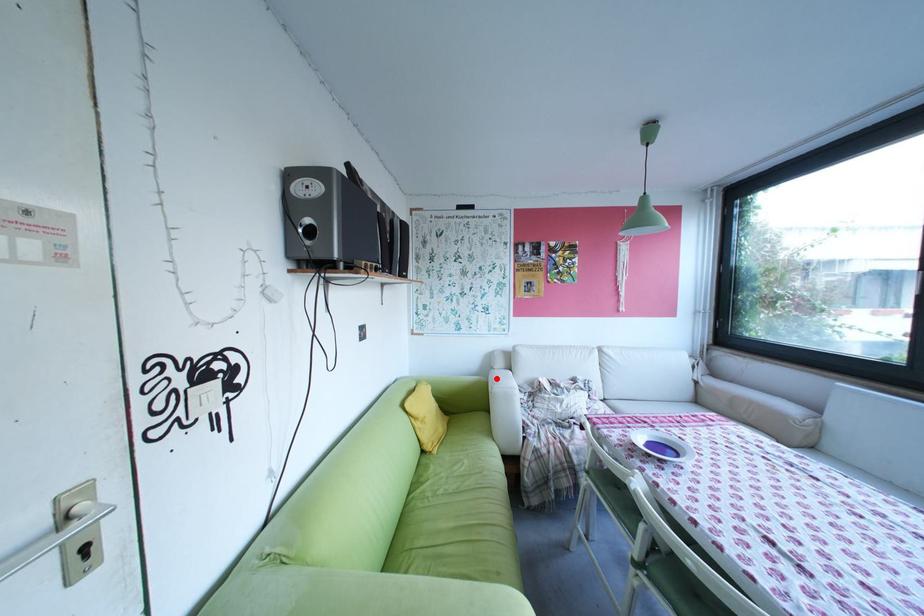
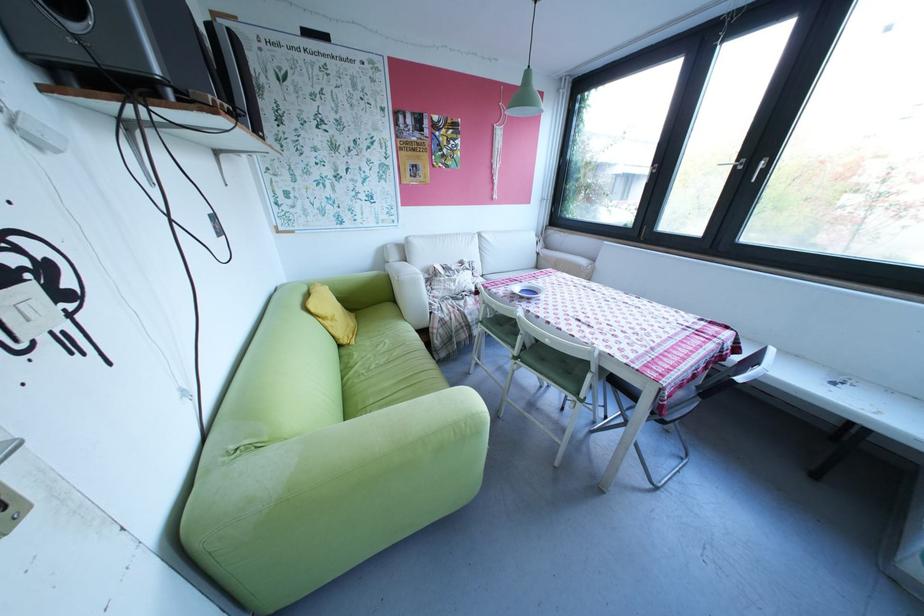
Find the pixel in the second image that matches the highlighted location in the first image.

(395, 273)